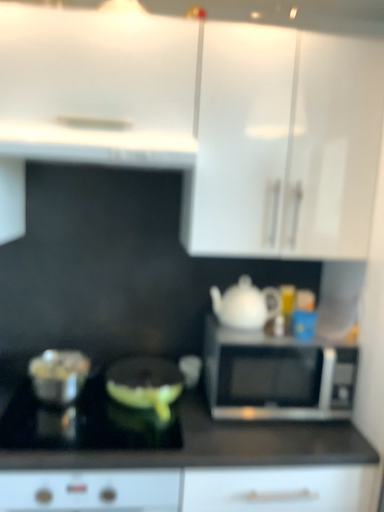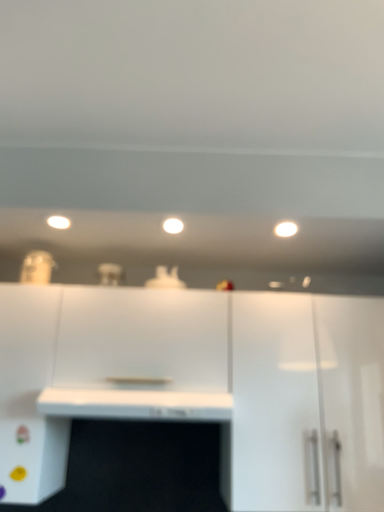
Question: How did the camera likely rotate when shooting the video?

Choices:
 (A) rotated downward
 (B) rotated upward

Answer: (B)